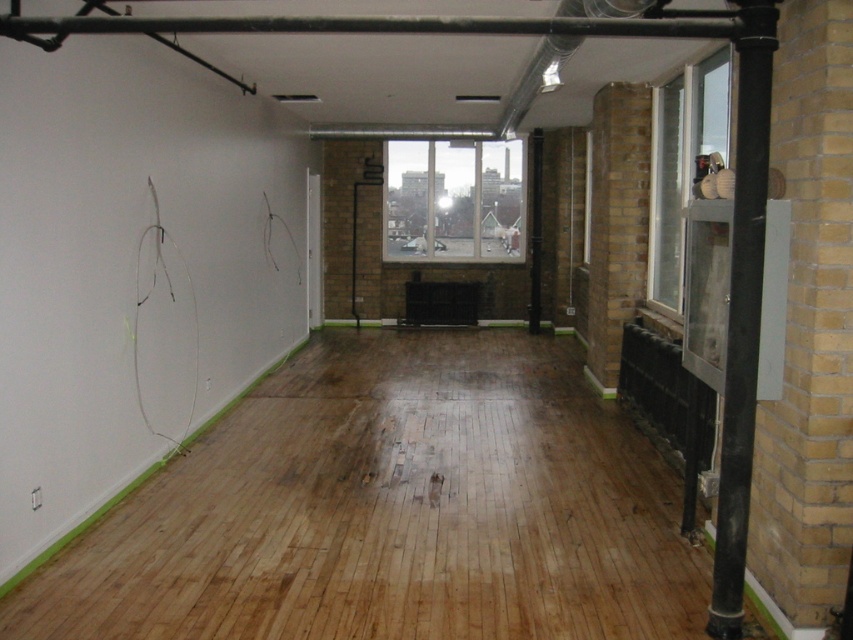
You are a contractor assessing the room for safety. You notice the natural wood flooring at center and the clear glass window at center. Which object is shorter in height?

The natural wood flooring at center is not as tall as the clear glass window at center, so the natural wood flooring at center is shorter in height.

You are standing in the middle of the room and want to move towards the point that is closer to you. Which point should you walk towards, point (724, 545) or point (412, 148)?

You should walk towards point (724, 545) because it is closer to you than point (412, 148).

You are moving a large piece of furniture that is 2 meters wide. You need to pass through the space between the black metal pole at right and the clear glass window at center. Is there enough space for the furniture to pass through?

The black metal pole at right has a smaller size compared to clear glass window at center, but the description does not provide specific measurements of the space between them. Therefore, it is unclear if the 2 meter wide furniture can pass through.